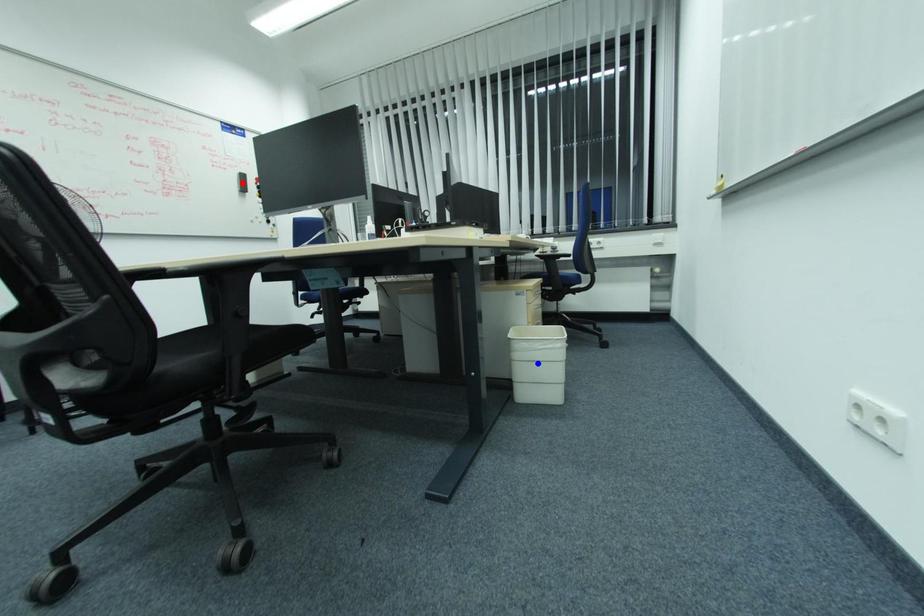
Question: Which of the two points in the image is closer to the camera?

Choices:
 (A) Blue point is closer.
 (B) Red point is closer.

Answer: (A)